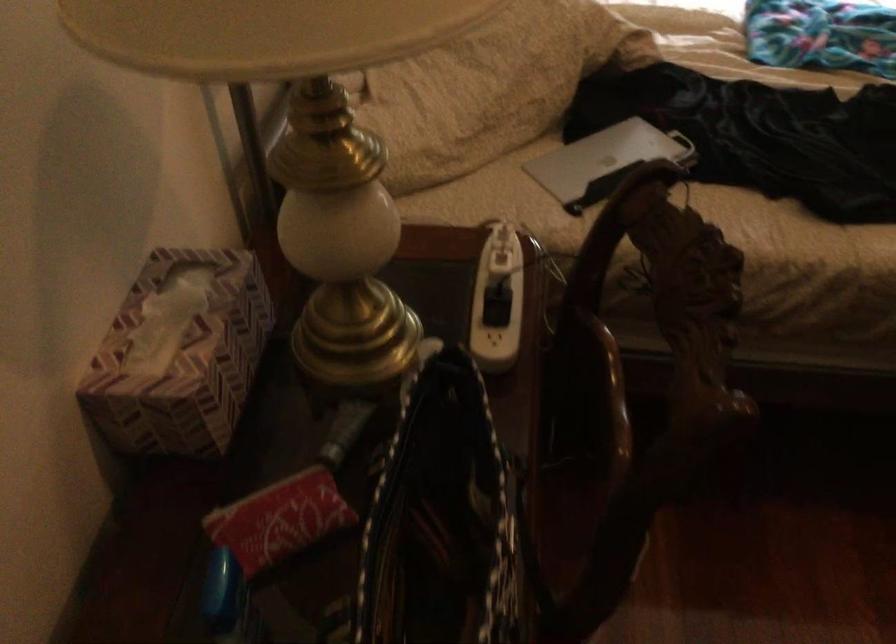
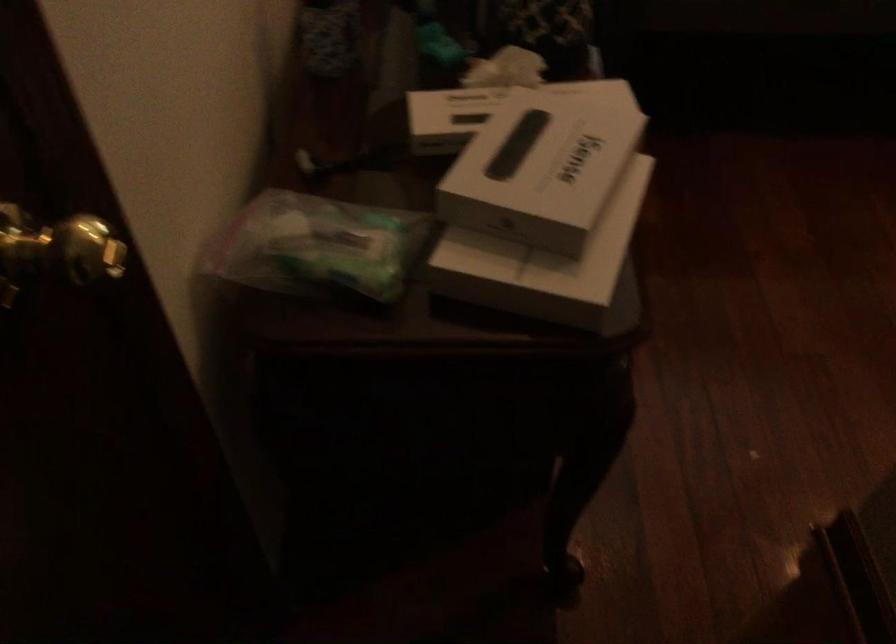
In a continuous first-person perspective shot, in which direction is the camera moving?

The cameraman moved toward left, backward.